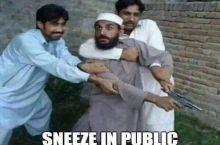
Where is `brick wall`? brick wall is located at coordinates (202, 66).